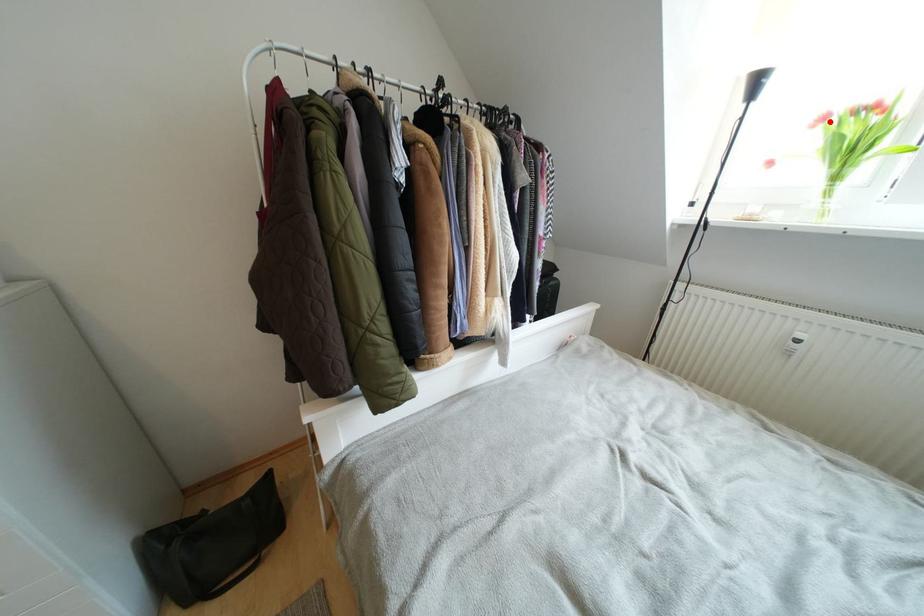
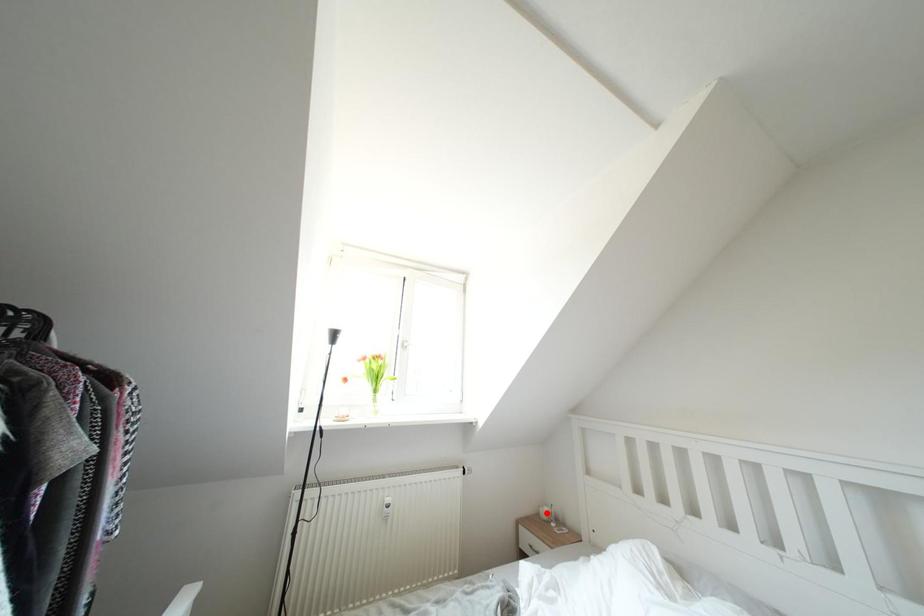
I am providing you with two images of the same scene from different viewpoints. A red point is marked on the first image and another point is marked on the second image. Is the marked point in image1 the same physical position as the marked point in image2?

No